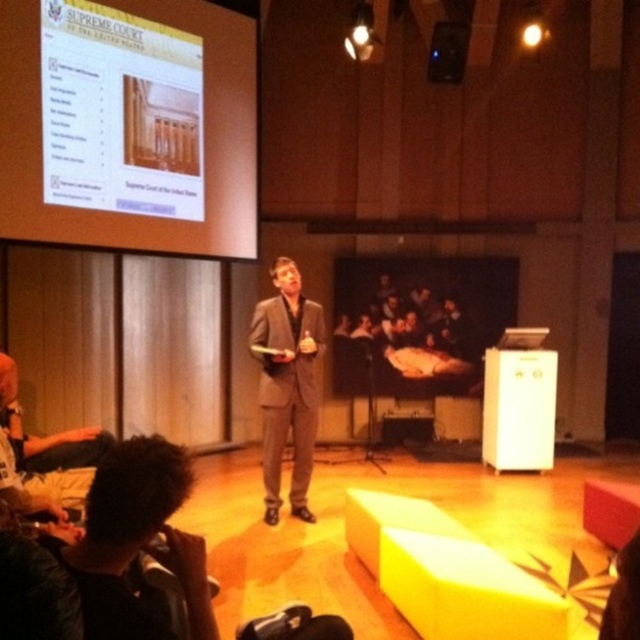
Based on the scene description, what object is located at the coordinates point (129, 124)?

The point (129, 124) indicates the white glossy projection screen at upper left.

You are an attendee sitting in the front row of the conference room. You need to look at the white glossy projection screen at upper left and the matte gray suit at center. Which one is located to the left of the other?

The white glossy projection screen at upper left is to the left of the matte gray suit at center.